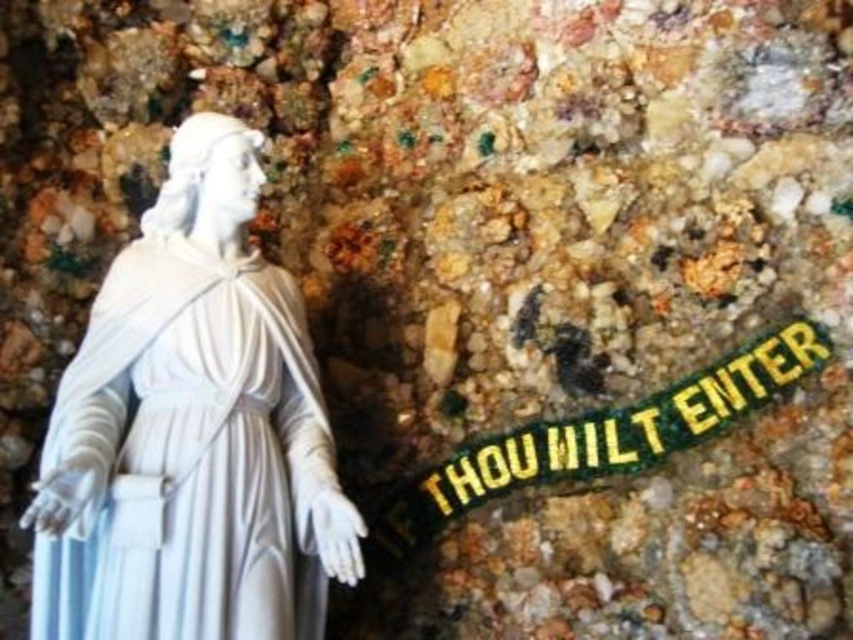
Question: Can you confirm if white marble statue at left is smaller than green/yellow fabric text at center?

Choices:
 (A) yes
 (B) no

Answer: (B)

Question: Can you confirm if white marble statue at left is positioned above green/yellow fabric text at center?

Choices:
 (A) no
 (B) yes

Answer: (B)

Question: Does white marble statue at left have a greater width compared to green/yellow fabric text at center?

Choices:
 (A) yes
 (B) no

Answer: (B)

Question: Which point is closer to the camera?

Choices:
 (A) (804, 323)
 (B) (199, 588)

Answer: (B)

Question: Which object is farther from the camera taking this photo?

Choices:
 (A) white marble statue at left
 (B) green/yellow fabric text at center

Answer: (B)

Question: Which of the following is the farthest from the observer?

Choices:
 (A) (749, 408)
 (B) (207, 468)

Answer: (A)